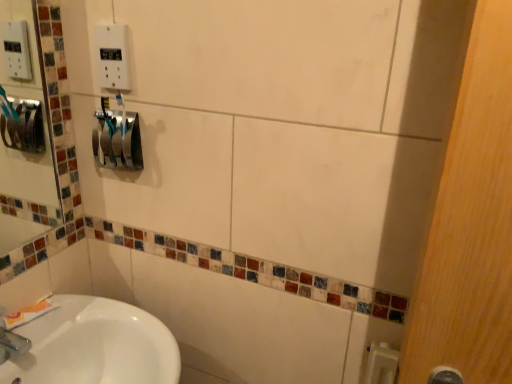
Consider the image. In order to face white matte toothpaste at lower left, should I rotate leftwards or rightwards?

To face it directly, rotate left by 28.325 degrees.

Find the location of a particular element. Image resolution: width=512 pixels, height=384 pixels. white matte toothpaste at lower left is located at coordinates (29, 313).

Is white matte toothpaste at lower left bigger or smaller than white plastic outlet at upper center?

Clearly, white matte toothpaste at lower left is larger in size than white plastic outlet at upper center.

Is white matte toothpaste at lower left in contact with white plastic outlet at upper center?

white matte toothpaste at lower left and white plastic outlet at upper center are not in contact.

Does white matte toothpaste at lower left appear on the right side of white plastic outlet at upper center?

Incorrect, white matte toothpaste at lower left is not on the right side of white plastic outlet at upper center.

From the image's perspective, does white matte toothpaste at lower left appear lower than white plastic outlet at upper center?

Correct, white matte toothpaste at lower left appears lower than white plastic outlet at upper center in the image.

Considering the sizes of objects blue glossy toothbrush at center-left and white plastic outlet at upper center in the image provided, who is bigger, blue glossy toothbrush at center-left or white plastic outlet at upper center?

Bigger between the two is white plastic outlet at upper center.

Which is more to the left, blue glossy toothbrush at center-left or white plastic outlet at upper center?

blue glossy toothbrush at center-left.

Between blue glossy toothbrush at center-left and white plastic outlet at upper center, which one has smaller width?

white plastic outlet at upper center is thinner.

What are the coordinates of `electric outlet on the right of blue glossy toothbrush at center-left` in the screenshot? It's located at (113, 57).

Is blue glossy toothbrush at center-left facing towards white matte toothpaste at lower left?

No.

At what (x,y) coordinates should I click in order to perform the action: click on toothpaste on the left of blue glossy toothbrush at center-left. Please return your answer as a coordinate pair (x, y). The image size is (512, 384). Looking at the image, I should click on (29, 313).

Between blue glossy toothbrush at center-left and white matte toothpaste at lower left, which one is positioned in front?

Positioned in front is blue glossy toothbrush at center-left.

Which object is positioned more to the left, blue glossy toothbrush at center-left or white matte toothpaste at lower left?

white matte toothpaste at lower left is more to the left.

Can you tell me how much white plastic outlet at upper center and blue glossy toothbrush at center-left differ in facing direction?

The facing directions of white plastic outlet at upper center and blue glossy toothbrush at center-left are 0.34 degrees apart.

From the image's perspective, which object appears higher, white plastic outlet at upper center or blue glossy toothbrush at center-left?

white plastic outlet at upper center is shown above in the image.

Is point (98, 57) positioned before point (111, 129)?

Yes, it is in front of point (111, 129).

Is white plastic outlet at upper center located outside blue glossy toothbrush at center-left?

white plastic outlet at upper center is positioned outside blue glossy toothbrush at center-left.

From the image's perspective, is white matte toothpaste at lower left above or below blue glossy toothbrush at center-left?

white matte toothpaste at lower left is below blue glossy toothbrush at center-left.

In the scene shown: From a real-world perspective, is white matte toothpaste at lower left positioned above or below blue glossy toothbrush at center-left?

In terms of real-world spatial position, white matte toothpaste at lower left is below blue glossy toothbrush at center-left.

Is white matte toothpaste at lower left next to blue glossy toothbrush at center-left and touching it?

No, white matte toothpaste at lower left is not making contact with blue glossy toothbrush at center-left.

Considering the relative positions of white matte toothpaste at lower left and blue glossy toothbrush at center-left in the image provided, is white matte toothpaste at lower left to the right of blue glossy toothbrush at center-left from the viewer's perspective?

No.

Visually, is white plastic outlet at upper center positioned to the left or to the right of white matte toothpaste at lower left?

white plastic outlet at upper center is to the right of white matte toothpaste at lower left.

From a real-world perspective, relative to white matte toothpaste at lower left, is white plastic outlet at upper center vertically above or below?

white plastic outlet at upper center is situated higher than white matte toothpaste at lower left in the real world.

Locate an element on the screen. The image size is (512, 384). electric outlet in front of the white matte toothpaste at lower left is located at coordinates (113, 57).

Is white plastic outlet at upper center taller than white matte toothpaste at lower left?

Yes.

Where is `toothpaste below the white plastic outlet at upper center (from a real-world perspective)`? toothpaste below the white plastic outlet at upper center (from a real-world perspective) is located at coordinates (29, 313).

This screenshot has height=384, width=512. I want to click on electric outlet in front of the blue glossy toothbrush at center-left, so click(x=113, y=57).

When comparing their distances from white matte toothpaste at lower left, does blue glossy toothbrush at center-left or white plastic outlet at upper center seem further?

white plastic outlet at upper center is positioned further to the anchor white matte toothpaste at lower left.

Looking at the image, which one is located further to blue glossy toothbrush at center-left, white plastic outlet at upper center or white matte toothpaste at lower left?

Based on the image, white matte toothpaste at lower left appears to be further to blue glossy toothbrush at center-left.

When comparing their distances from white plastic outlet at upper center, does white matte toothpaste at lower left or blue glossy toothbrush at center-left seem closer?

blue glossy toothbrush at center-left is positioned closer to the anchor white plastic outlet at upper center.

Based on their spatial positions, is blue glossy toothbrush at center-left or white matte toothpaste at lower left further from white plastic outlet at upper center?

white matte toothpaste at lower left lies further to white plastic outlet at upper center than the other object.

When comparing their distances from white matte toothpaste at lower left, does white plastic outlet at upper center or blue glossy toothbrush at center-left seem closer?

Among the two, blue glossy toothbrush at center-left is located nearer to white matte toothpaste at lower left.

Estimate the real-world distances between objects in this image. Which object is closer to blue glossy toothbrush at center-left, white matte toothpaste at lower left or white plastic outlet at upper center?

Based on the image, white plastic outlet at upper center appears to be nearer to blue glossy toothbrush at center-left.

Locate an element on the screen. This screenshot has height=384, width=512. toothbrush between white plastic outlet at upper center and white matte toothpaste at lower left vertically is located at coordinates (108, 127).